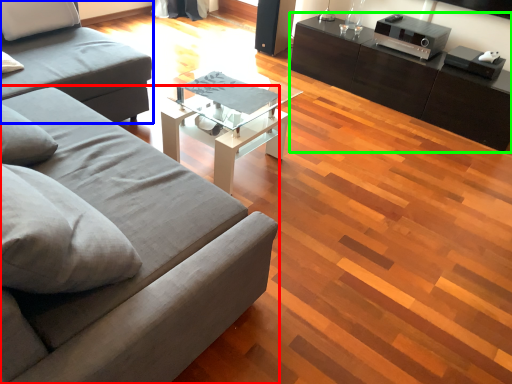
Question: Considering the real-world distances, which object is closest to studio couch (highlighted by a red box)? studio couch (highlighted by a blue box) or table (highlighted by a green box).

Choices:
 (A) studio couch
 (B) table

Answer: (A)